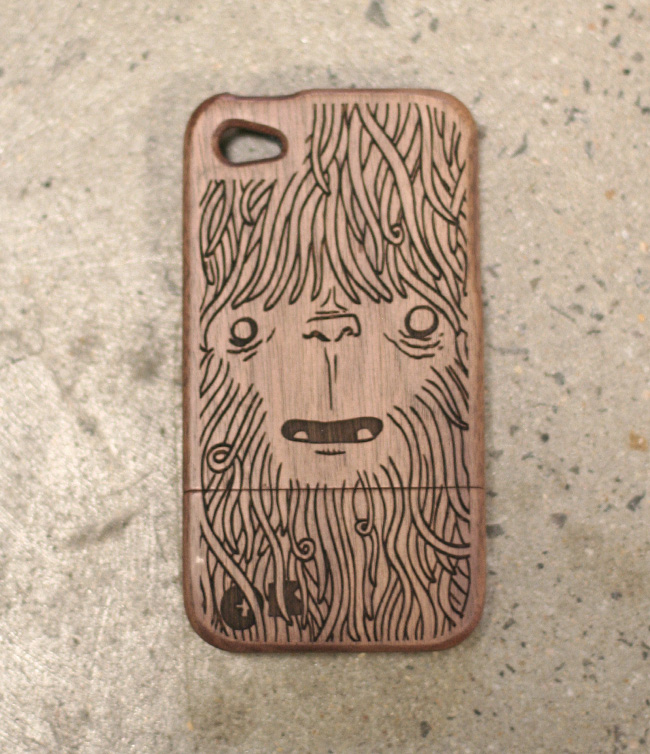
The height and width of the screenshot is (754, 650). Identify the location of counter. (602, 504).